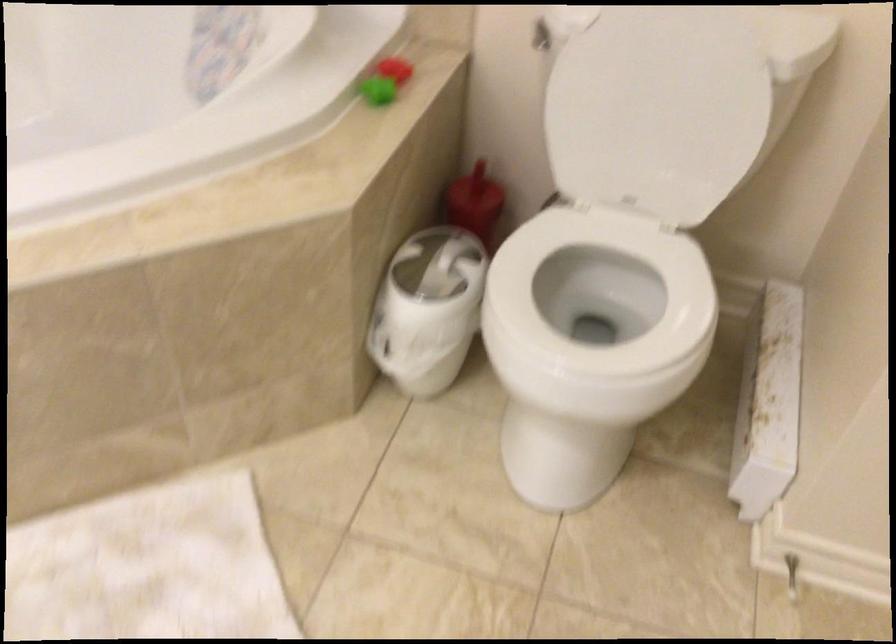
Locate an element on the screen. red toilet brush handle is located at coordinates (479, 180).